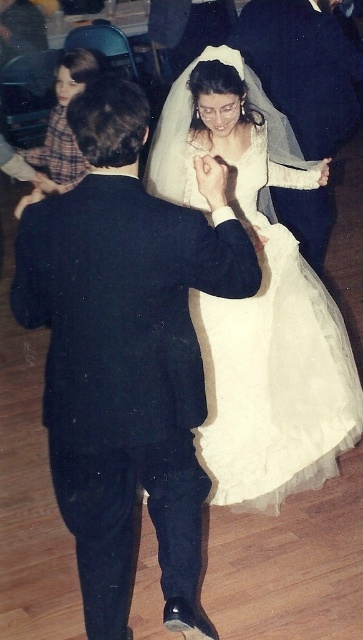
Is dark blue suit at center bigger than matte black suit at center?

Indeed, dark blue suit at center has a larger size compared to matte black suit at center.

Is dark blue suit at center taller than matte black suit at center?

Yes, dark blue suit at center is taller than matte black suit at center.

Locate an element on the screen. This screenshot has height=640, width=363. dark blue suit at center is located at coordinates (127, 353).

Is dark blue suit at center to the left of white tulle dress at center from the viewer's perspective?

Correct, you'll find dark blue suit at center to the left of white tulle dress at center.

Between point (144, 113) and point (264, 173), which one is positioned in front?

Point (144, 113)

Locate an element on the screen. dark blue suit at center is located at coordinates (127, 353).

At what (x,y) coordinates should I click in order to perform the action: click on dark blue suit at center. Please return your answer as a coordinate pair (x, y). Looking at the image, I should click on (127, 353).

Can you confirm if white tulle dress at center is positioned above matte black suit at center?

Actually, white tulle dress at center is below matte black suit at center.

Is white tulle dress at center taller than matte black suit at center?

Indeed, white tulle dress at center has a greater height compared to matte black suit at center.

Locate an element on the screen. white tulle dress at center is located at coordinates pos(260,314).